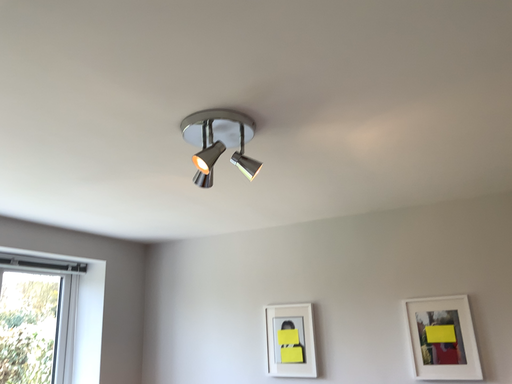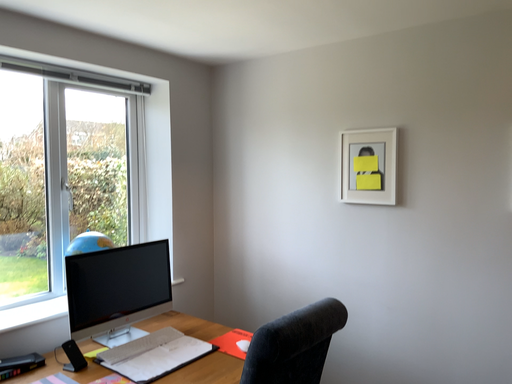
Question: How did the camera likely rotate when shooting the video?

Choices:
 (A) rotated upward
 (B) rotated downward

Answer: (B)